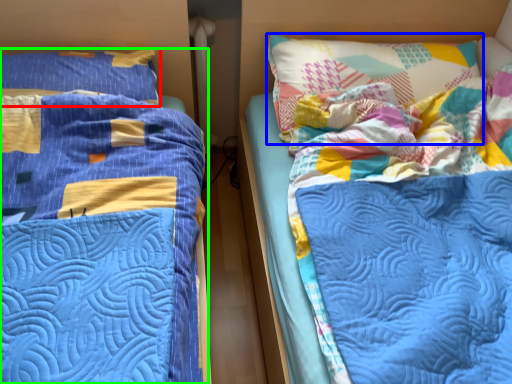
Question: Which object is positioned closest to pillow (highlighted by a red box)? Select from pillow (highlighted by a blue box) and bed (highlighted by a green box).

Choices:
 (A) pillow
 (B) bed

Answer: (B)